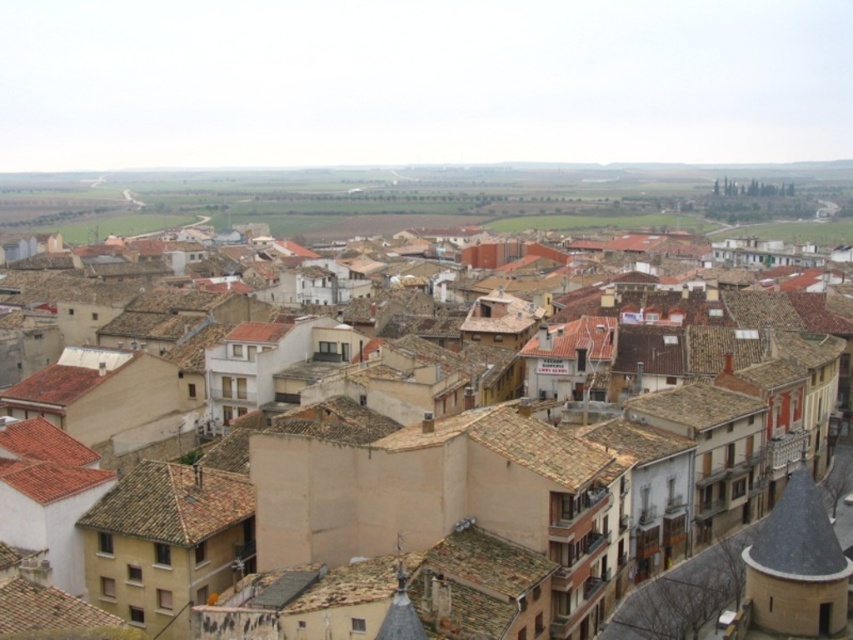
Question: Does brown tile roof at center appear on the left side of brown tile roof at lower left?

Choices:
 (A) no
 (B) yes

Answer: (A)

Question: Does brown tile roof at center have a smaller size compared to brown tile roof at lower left?

Choices:
 (A) no
 (B) yes

Answer: (A)

Question: Observing the image, what is the correct spatial positioning of brown tile roof at center in reference to brown tile roof at lower left?

Choices:
 (A) right
 (B) left

Answer: (A)